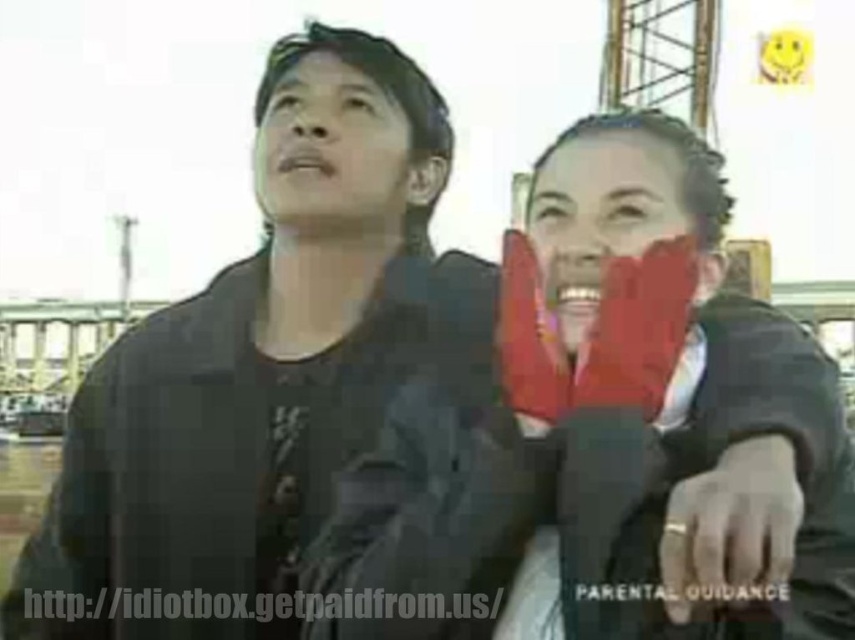
Question: Does matte black face at upper center have a smaller size compared to matte red gloves at center?

Choices:
 (A) yes
 (B) no

Answer: (A)

Question: Which point is farther from the camera taking this photo?

Choices:
 (A) (700, 291)
 (B) (786, 509)
 (C) (311, 61)

Answer: (C)

Question: Considering the real-world distances, which object is farthest from the matte black gloves at center?

Choices:
 (A) matte red gloves at center
 (B) matte black face at upper center

Answer: (B)

Question: Which object appears closest to the camera in this image?

Choices:
 (A) matte black gloves at center
 (B) matte red gloves at center
 (C) matte black face at upper center

Answer: (A)

Question: Does matte black face at upper center appear over matte red gloves at center?

Choices:
 (A) no
 (B) yes

Answer: (B)

Question: Observing the image, what is the correct spatial positioning of matte black gloves at center in reference to matte red gloves at center?

Choices:
 (A) right
 (B) left

Answer: (A)